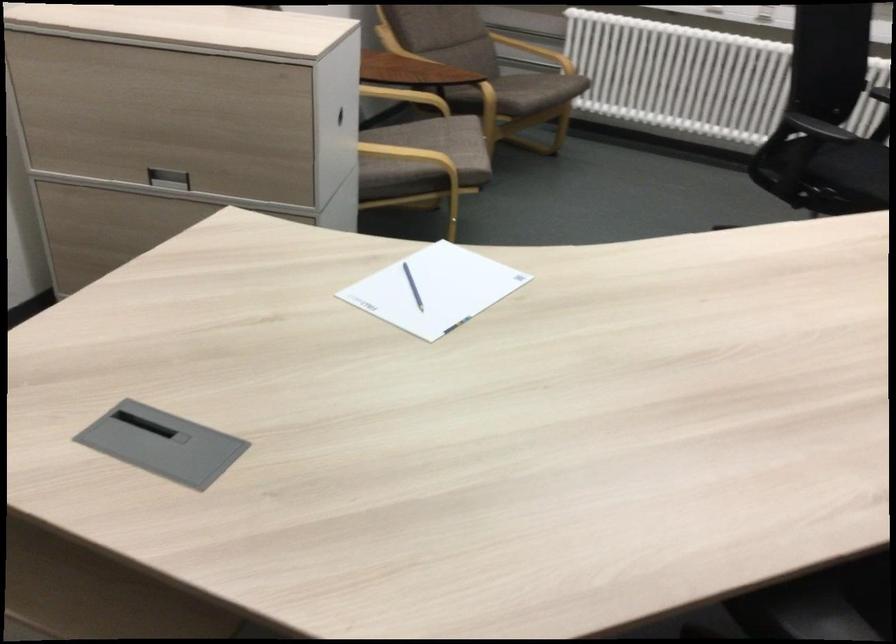
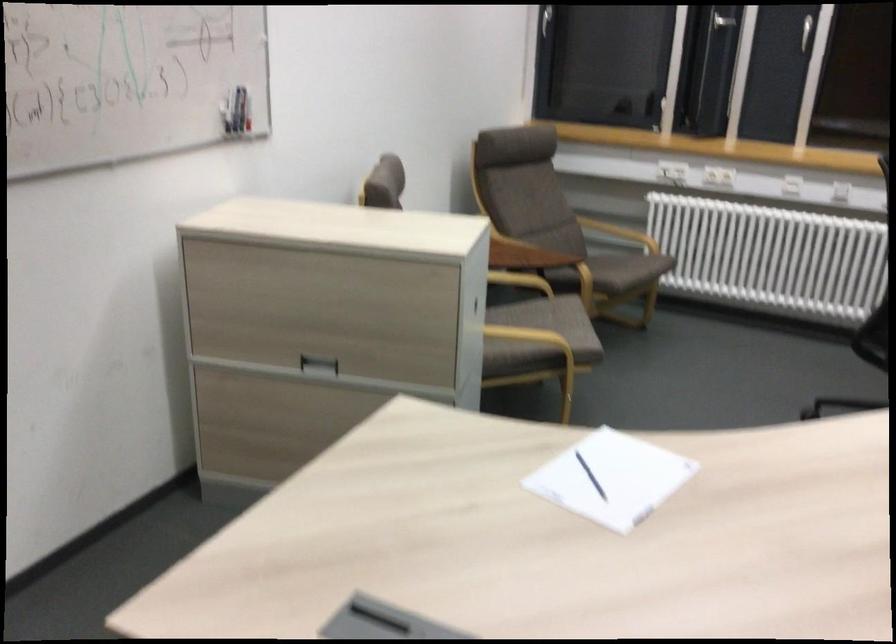
Question: Based on the continuous images, in which direction is the camera rotating? Reply with the corresponding letter.

Choices:
 (A) Left
 (B) Right
 (C) Up
 (D) Down

Answer: (C)